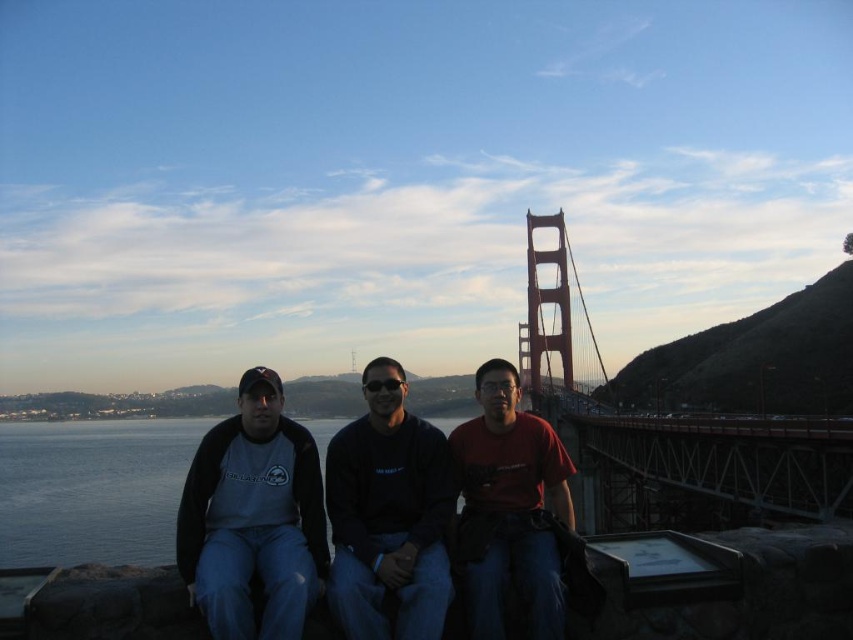
Does black matte sweatshirt at center have a greater height compared to red matte shirt at center?

Incorrect, black matte sweatshirt at center's height is not larger of red matte shirt at center's.

Is black matte sweatshirt at center closer to camera compared to red matte shirt at center?

No.

Between point (428, 627) and point (486, 557), which one is positioned behind?

The point (486, 557) is more distant.

Identify the location of black matte sweatshirt at center. The width and height of the screenshot is (853, 640). (387, 515).

Between point (648, 372) and point (479, 474), which one is positioned in front?

Point (479, 474) is more forward.

Between point (759, 310) and point (463, 500), which one is positioned behind?

The point (759, 310) is more distant.

Identify the location of metallic steel suspension bridge at right. (693, 404).

I want to click on metallic steel suspension bridge at right, so click(693, 404).

Is matte gray sweatshirt at left above black matte sweatshirt at center?

Actually, matte gray sweatshirt at left is below black matte sweatshirt at center.

Is point (215, 536) positioned in front of point (369, 579)?

No, it is behind (369, 579).

What do you see at coordinates (253, 518) in the screenshot? I see `matte gray sweatshirt at left` at bounding box center [253, 518].

Locate an element on the screen. This screenshot has width=853, height=640. matte gray sweatshirt at left is located at coordinates (253, 518).